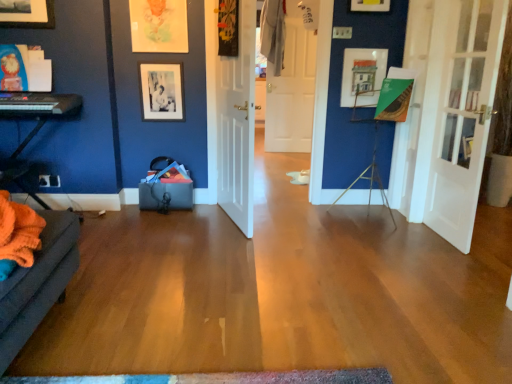
Identify the location of vacant region above matte wooden picture frame at upper center, marked as the first picture frame in a right-to-left arrangement (from a real-world perspective). The width and height of the screenshot is (512, 384). (362, 49).